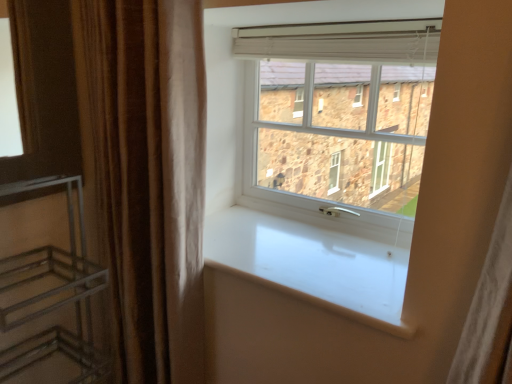
Where is `brown velvet curtain at left`? The width and height of the screenshot is (512, 384). brown velvet curtain at left is located at coordinates (149, 177).

This screenshot has width=512, height=384. What do you see at coordinates (53, 303) in the screenshot?
I see `metallic silver shelf at left` at bounding box center [53, 303].

This screenshot has height=384, width=512. Describe the element at coordinates (341, 131) in the screenshot. I see `white plastic window at center` at that location.

Locate an element on the screen. Image resolution: width=512 pixels, height=384 pixels. white glossy window sill at center is located at coordinates (312, 263).

Find the location of a particular element. This screenshot has height=384, width=512. brown velvet curtain at left is located at coordinates (149, 177).

Does white plastic window at center have a greater width compared to metallic silver shelf at left?

No, white plastic window at center is not wider than metallic silver shelf at left.

Considering the sizes of white plastic window at center and metallic silver shelf at left in the image, is white plastic window at center bigger or smaller than metallic silver shelf at left?

white plastic window at center is smaller than metallic silver shelf at left.

Where is `window screen lying behind the metallic silver shelf at left`? Image resolution: width=512 pixels, height=384 pixels. window screen lying behind the metallic silver shelf at left is located at coordinates (341, 131).

Where is `window sill below the white plastic window at center (from a real-world perspective)`? window sill below the white plastic window at center (from a real-world perspective) is located at coordinates (312, 263).

Is white plastic window at center looking in the opposite direction of white glossy window sill at center?

white plastic window at center does not have its back to white glossy window sill at center.

Considering the positions of objects white plastic window at center and white glossy window sill at center in the image provided, who is more to the left, white plastic window at center or white glossy window sill at center?

Positioned to the left is white glossy window sill at center.

Is the surface of white plastic window at center in direct contact with white glossy window sill at center?

No.

Is white glossy window sill at center next to metallic silver shelf at left?

No, white glossy window sill at center is not beside metallic silver shelf at left.

Is white glossy window sill at center not within metallic silver shelf at left?

Indeed, white glossy window sill at center is completely outside metallic silver shelf at left.

From a real-world perspective, between white glossy window sill at center and metallic silver shelf at left, who is vertically lower?

metallic silver shelf at left, from a real-world perspective.

Considering the sizes of white glossy window sill at center and metallic silver shelf at left in the image, is white glossy window sill at center bigger or smaller than metallic silver shelf at left?

In the image, white glossy window sill at center appears to be smaller than metallic silver shelf at left.

How many degrees apart are the facing directions of metallic silver shelf at left and white glossy window sill at center?

The angular difference between metallic silver shelf at left and white glossy window sill at center is 87.9 degrees.

Which is more distant, (66, 304) or (394, 319)?

The point (66, 304) is more distant.

Is there a large distance between metallic silver shelf at left and white glossy window sill at center?

That's not correct — metallic silver shelf at left is a little close to white glossy window sill at center.

Is metallic silver shelf at left spatially inside white glossy window sill at center, or outside of it?

metallic silver shelf at left is located beyond the bounds of white glossy window sill at center.

Would you consider white plastic window at center to be distant from brown velvet curtain at left?

white plastic window at center is near brown velvet curtain at left, not far away.

From the image's perspective, is white plastic window at center over brown velvet curtain at left?

Yes, from the image's perspective, white plastic window at center is on top of brown velvet curtain at left.

Can you confirm if white plastic window at center is taller than brown velvet curtain at left?

No, white plastic window at center is not taller than brown velvet curtain at left.

Can you tell me how much white plastic window at center and brown velvet curtain at left differ in facing direction?

They differ by 1.26 degrees in their facing directions.

Does white glossy window sill at center have a lesser width compared to white plastic window at center?

Incorrect, the width of white glossy window sill at center is not less than that of white plastic window at center.

Can you confirm if white glossy window sill at center is taller than white plastic window at center?

No, white glossy window sill at center is not taller than white plastic window at center.

From the image's perspective, which is above, white glossy window sill at center or white plastic window at center?

white plastic window at center, from the image's perspective.

From the picture: Is white glossy window sill at center directly adjacent to white plastic window at center?

There is a gap between white glossy window sill at center and white plastic window at center.

Is brown velvet curtain at left situated inside white glossy window sill at center or outside?

brown velvet curtain at left lies outside white glossy window sill at center.

Is point (122, 258) closer or farther from the camera than point (389, 322)?

Point (122, 258) is positioned farther from the camera compared to point (389, 322).

Consider the image. Between brown velvet curtain at left and white glossy window sill at center, which one has less height?

Standing shorter between the two is white glossy window sill at center.

Image resolution: width=512 pixels, height=384 pixels. Find the location of `window screen that appears above the metallic silver shelf at left (from a real-world perspective)`. window screen that appears above the metallic silver shelf at left (from a real-world perspective) is located at coordinates tap(341, 131).

This screenshot has height=384, width=512. Find the location of `window sill on the left side of white plastic window at center`. window sill on the left side of white plastic window at center is located at coordinates (312, 263).

Considering their positions, is metallic silver shelf at left positioned closer to brown velvet curtain at left than white plastic window at center?

metallic silver shelf at left is positioned closer to the anchor brown velvet curtain at left.

Estimate the real-world distances between objects in this image. Which object is closer to metallic silver shelf at left, brown velvet curtain at left or white glossy window sill at center?

brown velvet curtain at left.

Estimate the real-world distances between objects in this image. Which object is closer to white plastic window at center, white glossy window sill at center or metallic silver shelf at left?

white glossy window sill at center is positioned closer to the anchor white plastic window at center.

From the image, which object appears to be farther from white plastic window at center, metallic silver shelf at left or white glossy window sill at center?

metallic silver shelf at left lies further to white plastic window at center than the other object.

When comparing their distances from white plastic window at center, does metallic silver shelf at left or brown velvet curtain at left seem closer?

Among the two, brown velvet curtain at left is located nearer to white plastic window at center.

Looking at the image, which one is located closer to brown velvet curtain at left, white plastic window at center or white glossy window sill at center?

The object closer to brown velvet curtain at left is white glossy window sill at center.

Considering their positions, is white plastic window at center positioned closer to metallic silver shelf at left than brown velvet curtain at left?

brown velvet curtain at left is positioned closer to the anchor metallic silver shelf at left.

Based on their spatial positions, is metallic silver shelf at left or white plastic window at center closer to white glossy window sill at center?

The object closer to white glossy window sill at center is white plastic window at center.

The width and height of the screenshot is (512, 384). In order to click on curtain between metallic silver shelf at left and white plastic window at center from left to right in this screenshot , I will do `click(149, 177)`.

Find the location of a particular element. Image resolution: width=512 pixels, height=384 pixels. curtain situated between metallic silver shelf at left and white glossy window sill at center from left to right is located at coordinates (149, 177).

This screenshot has height=384, width=512. What are the coordinates of `window sill located between metallic silver shelf at left and white plastic window at center in the left-right direction` in the screenshot? It's located at (312, 263).

I want to click on window sill between brown velvet curtain at left and white plastic window at center in the horizontal direction, so [x=312, y=263].